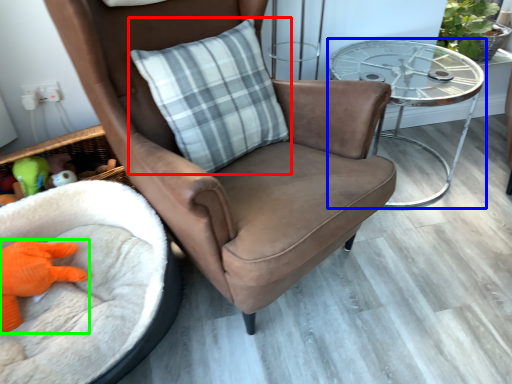
Question: Estimate the real-world distances between objects in this image. Which object is farther from pillow (highlighted by a red box), table (highlighted by a blue box) or toy (highlighted by a green box)?

Choices:
 (A) table
 (B) toy

Answer: (B)